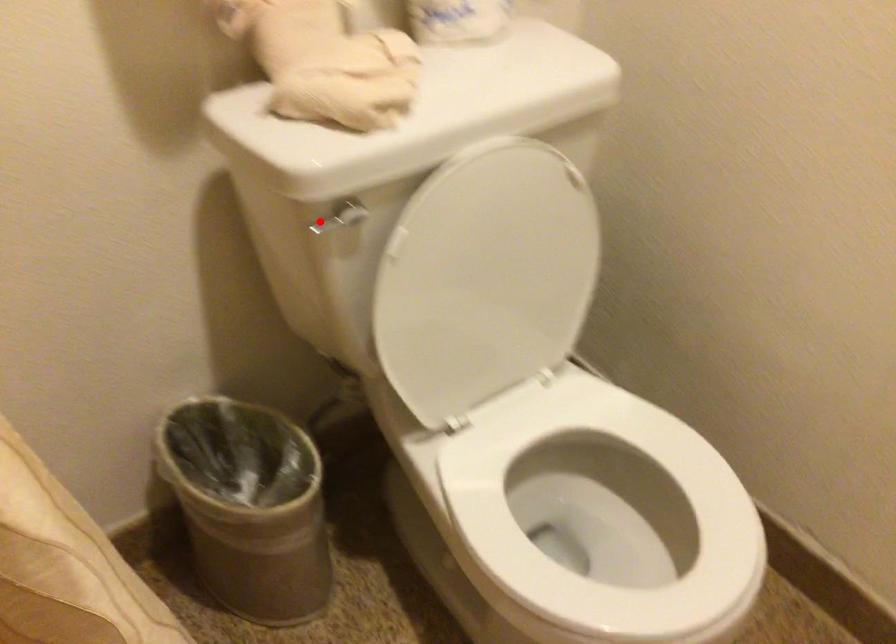
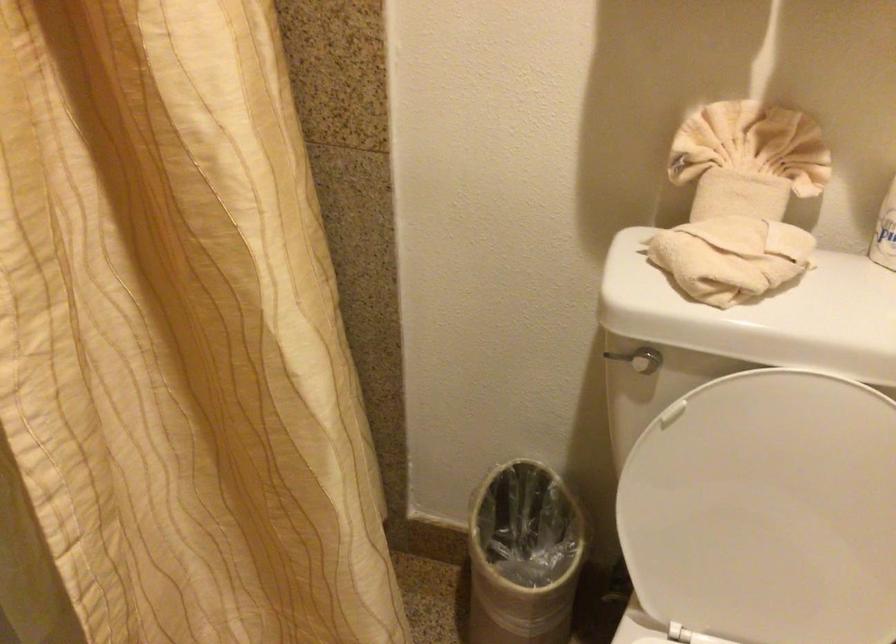
Where in the second image is the point corresponding to the highlighted location from the first image?

(616, 357)